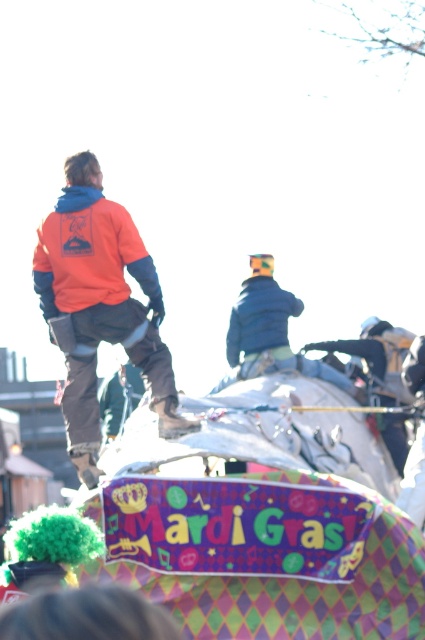
Which of these two, orange fleece jacket at upper left or blue fuzzy jacket at center, stands taller?

orange fleece jacket at upper left

What are the coordinates of `orange fleece jacket at upper left` in the screenshot? It's located at (99, 307).

Who is more forward, (141, 342) or (229, 339)?

Point (141, 342)

Where is `orange fleece jacket at upper left`? orange fleece jacket at upper left is located at coordinates (99, 307).

Is orange fleece jacket at upper left in front of blue denim jacket at upper center?

Yes, orange fleece jacket at upper left is in front of blue denim jacket at upper center.

Who is more forward, (68, 365) or (360, 392)?

Point (68, 365) is more forward.

The height and width of the screenshot is (640, 425). I want to click on orange fleece jacket at upper left, so click(x=99, y=307).

Can you confirm if blue denim jacket at upper center is shorter than blue fuzzy jacket at center?

In fact, blue denim jacket at upper center may be taller than blue fuzzy jacket at center.

Between blue denim jacket at upper center and blue fuzzy jacket at center, which one appears on the right side from the viewer's perspective?

blue denim jacket at upper center is more to the right.

Who is more distant from viewer, (272, 365) or (272, 330)?

Positioned behind is point (272, 330).

The width and height of the screenshot is (425, 640). Find the location of `blue denim jacket at upper center`. blue denim jacket at upper center is located at coordinates (271, 332).